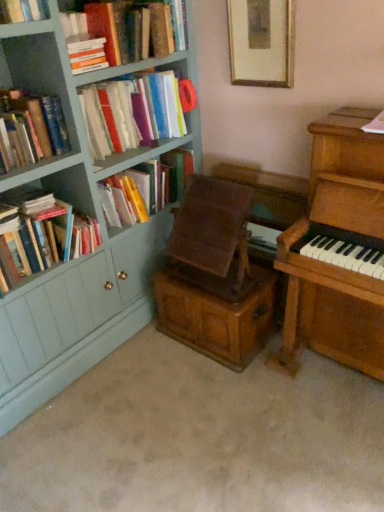
Question: Is wooden piano at right not within wooden chest at center?

Choices:
 (A) no
 (B) yes

Answer: (B)

Question: From a real-world perspective, is wooden piano at right located beneath wooden chest at center?

Choices:
 (A) no
 (B) yes

Answer: (A)

Question: From the image's perspective, is wooden piano at right on wooden chest at center?

Choices:
 (A) yes
 (B) no

Answer: (A)

Question: Is wooden piano at right not close to wooden chest at center?

Choices:
 (A) yes
 (B) no

Answer: (B)

Question: From a real-world perspective, is wooden piano at right positioned over wooden chest at center based on gravity?

Choices:
 (A) yes
 (B) no

Answer: (A)

Question: Does wooden piano at right lie in front of wooden chest at center?

Choices:
 (A) no
 (B) yes

Answer: (B)

Question: Is hardcover books at upper left, the fourth book positioned from the bottom, a part of hardcover book at upper left, arranged as the 2th book when viewed from the top?

Choices:
 (A) no
 (B) yes

Answer: (A)

Question: Is hardcover book at upper left, arranged as the 2th book when viewed from the top, taller than hardcover books at upper left, the fourth book positioned from the bottom?

Choices:
 (A) no
 (B) yes

Answer: (A)

Question: Does hardcover book at upper left, which is the 5th book from bottom to top, turn towards hardcover books at upper left, the third book from the top?

Choices:
 (A) yes
 (B) no

Answer: (B)

Question: Is hardcover book at upper left, which is the 5th book from bottom to top, oriented away from hardcover books at upper left, the fourth book positioned from the bottom?

Choices:
 (A) no
 (B) yes

Answer: (A)

Question: Is the depth of hardcover book at upper left, which is the 5th book from bottom to top, less than that of hardcover books at upper left, the third book from the top?

Choices:
 (A) yes
 (B) no

Answer: (A)

Question: From a real-world perspective, is hardcover book at upper left, arranged as the 2th book when viewed from the top, located beneath hardcover books at upper left, the third book from the top?

Choices:
 (A) no
 (B) yes

Answer: (A)

Question: Is wooden picture frame at upper center next to hardcover books at left, the 6th book in the top-to-bottom sequence, and touching it?

Choices:
 (A) yes
 (B) no

Answer: (B)